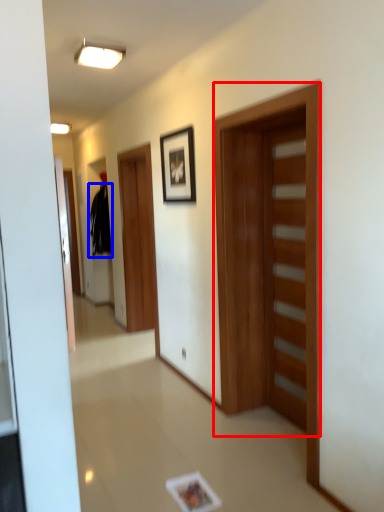
Question: Which object appears farthest to the camera in this image, door (highlighted by a red box) or sweatshirt (highlighted by a blue box)?

Choices:
 (A) door
 (B) sweatshirt

Answer: (B)